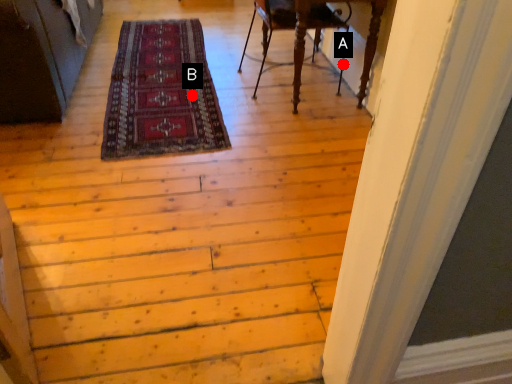
Question: Two points are circled on the image, labeled by A and B beside each circle. Which point is closer to the camera taking this photo?

Choices:
 (A) A is closer
 (B) B is closer

Answer: (B)